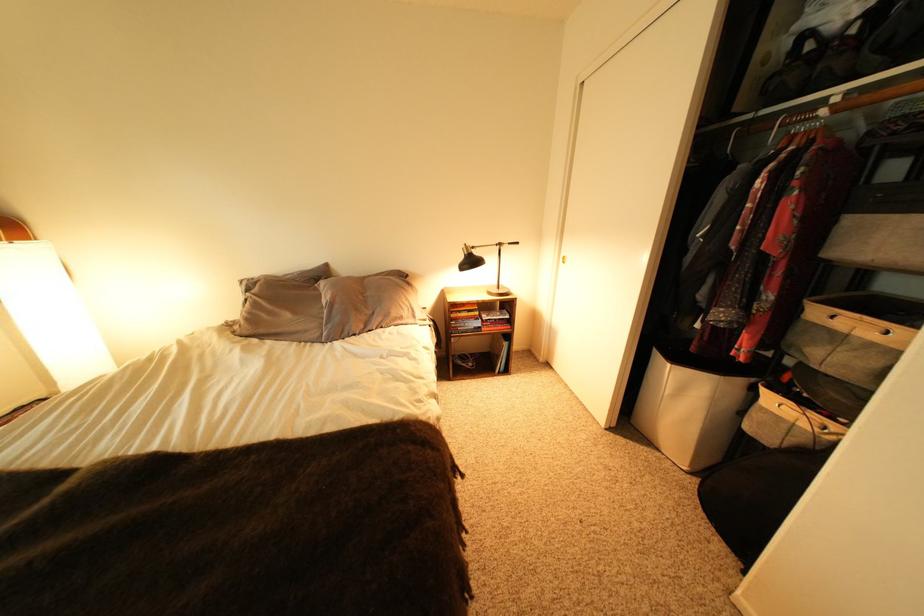
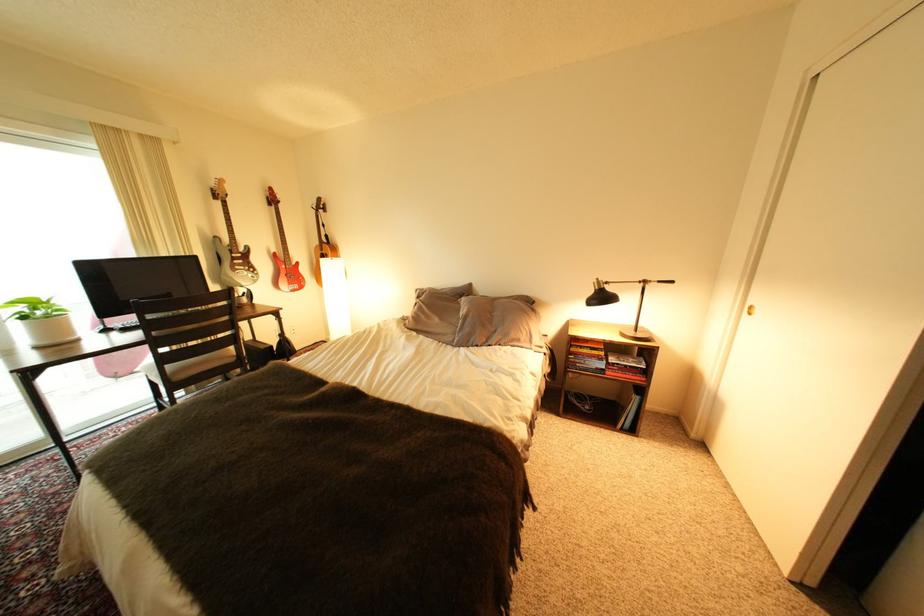
In the second image, find the point that corresponds to pixel 496 321 in the first image.

(623, 363)